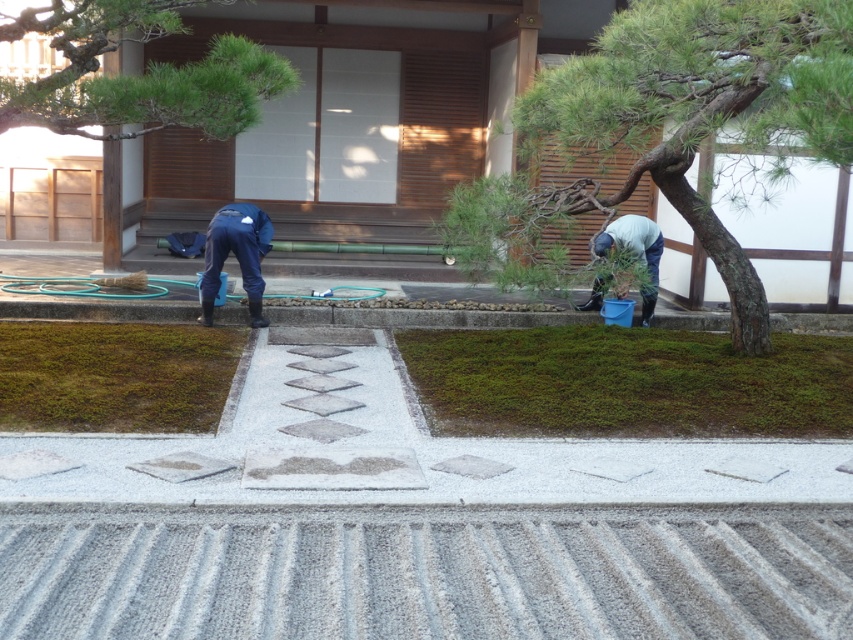
You are a visitor in the Japanese garden and want to walk from the gravel path to the area near the blue rubber boots at right. Which direction should you move relative to the green mossy ground at lower left?

You should move to the right side of the green mossy ground at lower left to reach the blue rubber boots at right.

Consider the image. You are a visitor walking along the gravel path in the Japanese garden. You want to take a photo of the green textured tree at center and the green mossy ground at lower left. Which object should you focus on first to ensure both are in the frame?

You should focus on the green textured tree at center first because it is closer to the viewer than the green mossy ground at lower left, so adjusting the focus on it will help both objects stay in the frame.

You are a visitor in the Japanese garden. You see the green textured tree at center and the green mossy ground at lower left. Which object is smaller in size?

The green textured tree at center has a smaller size compared to the green mossy ground at lower left.